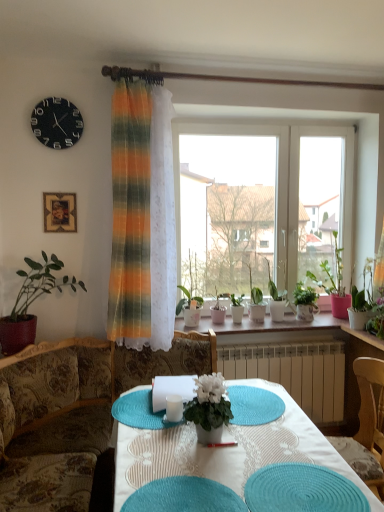
The height and width of the screenshot is (512, 384). I want to click on vacant space situated above teal fabric placemat at lower center (from a real-world perspective), so click(x=309, y=484).